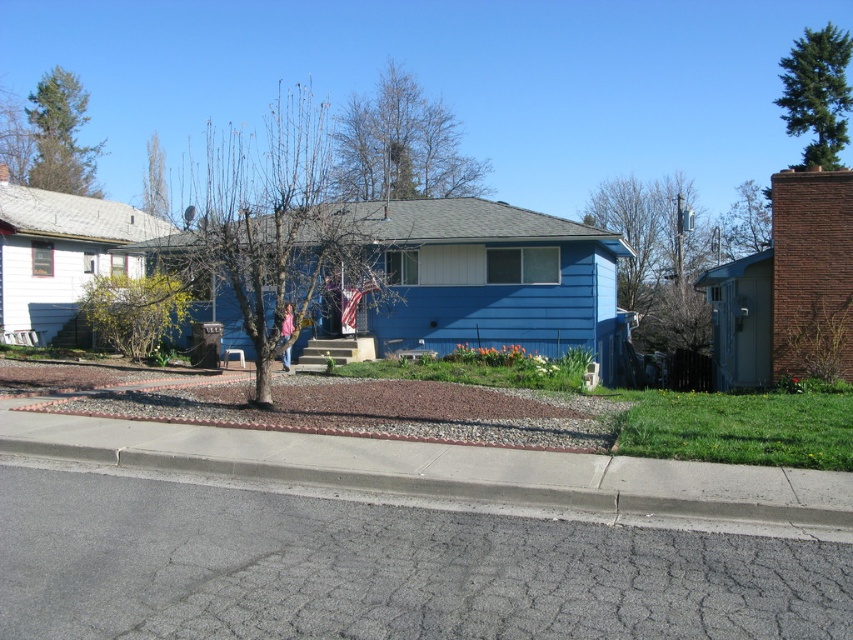
You are standing in the front yard of the suburban house and want to plant a new tree. The bare branches at center are currently occupying the spot you want. Can you move the bare branches at center to the point at coordinates point (x=279, y=230)?

The bare branches at center is already located at point (x=279, y=230), so you cannot move it there as it is already occupying that position.

You are standing in the front yard of the house and want to place a new garden ornament exactly where the bare branches at center are located. What are the coordinates of the spot where you should place it?

The coordinates for the bare branches at center are at point (279, 230), so you should place the garden ornament there.